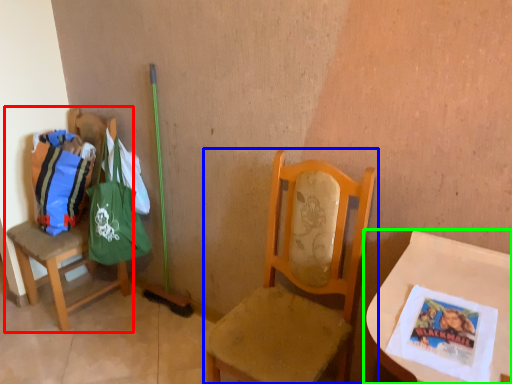
Question: Which is nearer to the chair (highlighted by a red box)? chair (highlighted by a blue box) or table (highlighted by a green box).

Choices:
 (A) chair
 (B) table

Answer: (A)